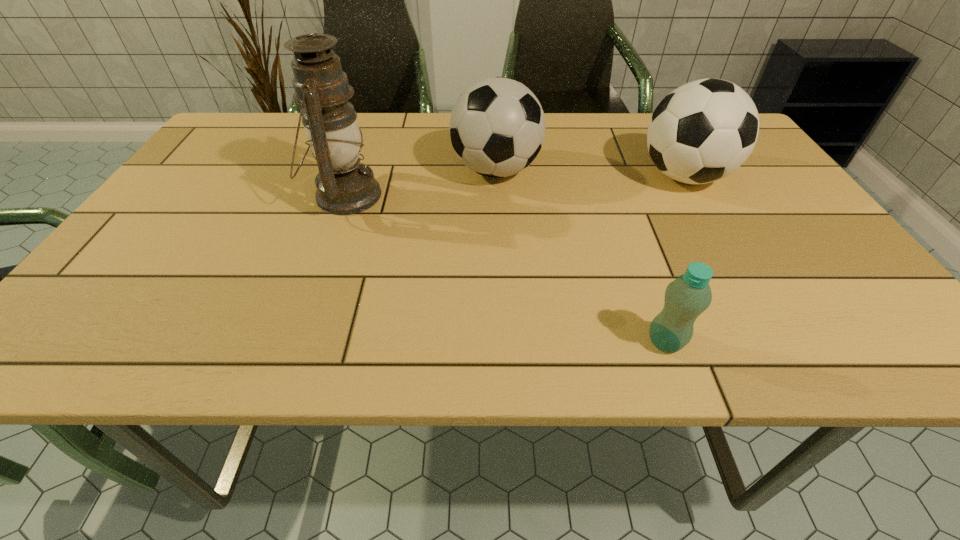
Where is `vacant space that is in between the third object from right to left and the rightmost object`? This screenshot has height=540, width=960. vacant space that is in between the third object from right to left and the rightmost object is located at coordinates (590, 173).

The height and width of the screenshot is (540, 960). Find the location of `object that stands as the second closest to the rightmost object`. object that stands as the second closest to the rightmost object is located at coordinates (689, 295).

Select which object appears as the third closest to the rightmost object. Please provide its 2D coordinates. Your answer should be formatted as a tuple, i.e. [(x, y)], where the tuple contains the x and y coordinates of a point satisfying the conditions above.

[(345, 186)]

Identify the location of vacant area that satisfies the following two spatial constraints: 1. on the front side of the rightmost object; 2. at the front cap of the water bottle. Image resolution: width=960 pixels, height=540 pixels. (780, 342).